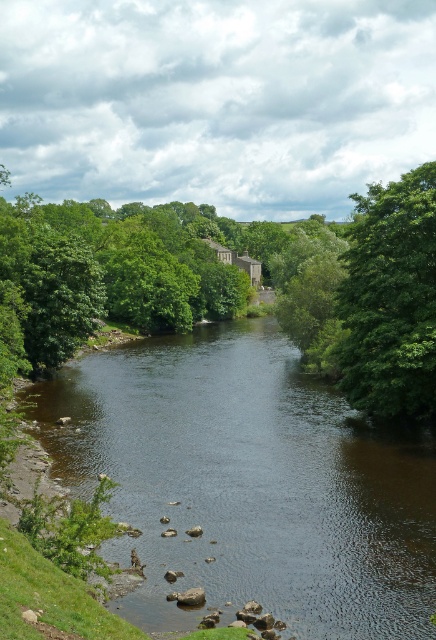
Question: Is dark brown water at center wider than green leafy tree at upper right?

Choices:
 (A) yes
 (B) no

Answer: (A)

Question: Is dark brown water at center positioned at the back of green leafy tree at upper right?

Choices:
 (A) no
 (B) yes

Answer: (A)

Question: From the image, what is the correct spatial relationship of dark brown water at center in relation to green leafy tree at upper right?

Choices:
 (A) right
 (B) left

Answer: (B)

Question: Which object appears farthest from the camera in this image?

Choices:
 (A) dark brown water at center
 (B) green leafy tree at upper right

Answer: (B)